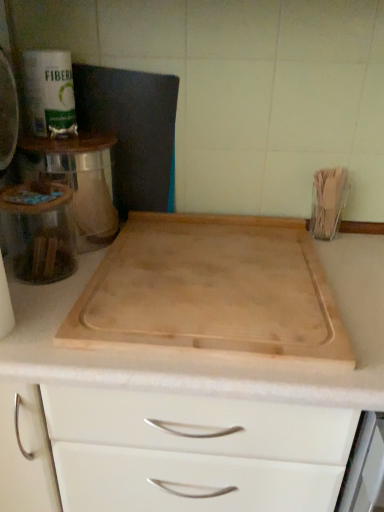
Question: From the image's perspective, does metallic silver toaster at upper left, which ranks as the 2th appliance in right-to-left order, appear higher than natural wood cutting board at center?

Choices:
 (A) yes
 (B) no

Answer: (A)

Question: Is metallic silver toaster at upper left, which is the first appliance from left to right, closer to camera compared to natural wood cutting board at center?

Choices:
 (A) no
 (B) yes

Answer: (A)

Question: Could you tell me if metallic silver toaster at upper left, which is counted as the 1th appliance, starting from the top, is turned towards natural wood cutting board at center?

Choices:
 (A) no
 (B) yes

Answer: (A)

Question: Can you confirm if metallic silver toaster at upper left, which ranks as the 2th appliance in right-to-left order, is bigger than natural wood cutting board at center?

Choices:
 (A) no
 (B) yes

Answer: (A)

Question: Does metallic silver toaster at upper left, which is counted as the 1th appliance, starting from the top, appear on the right side of natural wood cutting board at center?

Choices:
 (A) yes
 (B) no

Answer: (B)

Question: Is natural wood cutting board at center taller or shorter than clear glass jar at left, positioned as the 1th appliance in bottom-to-top order?

Choices:
 (A) tall
 (B) short

Answer: (B)

Question: Based on their sizes in the image, would you say natural wood cutting board at center is bigger or smaller than clear glass jar at left, positioned as the 1th appliance in bottom-to-top order?

Choices:
 (A) small
 (B) big

Answer: (B)

Question: Is natural wood cutting board at center spatially inside clear glass jar at left, the second appliance positioned from the left, or outside of it?

Choices:
 (A) outside
 (B) inside

Answer: (A)

Question: From the image's perspective, is natural wood cutting board at center positioned above or below clear glass jar at left, positioned as the 1th appliance in bottom-to-top order?

Choices:
 (A) above
 (B) below

Answer: (B)

Question: Choose the correct answer: Is clear glass jar at left, which ranks as the first appliance in right-to-left order, inside metallic silver toaster at upper left, which ranks as the second appliance in bottom-to-top order, or outside it?

Choices:
 (A) inside
 (B) outside

Answer: (B)

Question: From a real-world perspective, relative to metallic silver toaster at upper left, which ranks as the 2th appliance in right-to-left order, is clear glass jar at left, the second appliance positioned from the top, vertically above or below?

Choices:
 (A) below
 (B) above

Answer: (A)

Question: Looking at the image, does clear glass jar at left, the second appliance positioned from the left, seem bigger or smaller compared to metallic silver toaster at upper left, which ranks as the 2th appliance in right-to-left order?

Choices:
 (A) small
 (B) big

Answer: (B)

Question: In the image, is clear glass jar at left, positioned as the 1th appliance in bottom-to-top order, positioned in front of or behind metallic silver toaster at upper left, which ranks as the 2th appliance in right-to-left order?

Choices:
 (A) front
 (B) behind

Answer: (A)

Question: In the image, is metallic silver toaster at upper left, which is the first appliance from left to right, on the left side or the right side of clear glass jar at left, the second appliance positioned from the left?

Choices:
 (A) left
 (B) right

Answer: (A)

Question: From the image's perspective, is metallic silver toaster at upper left, which ranks as the second appliance in bottom-to-top order, located above or below clear glass jar at left, the second appliance positioned from the left?

Choices:
 (A) below
 (B) above

Answer: (B)